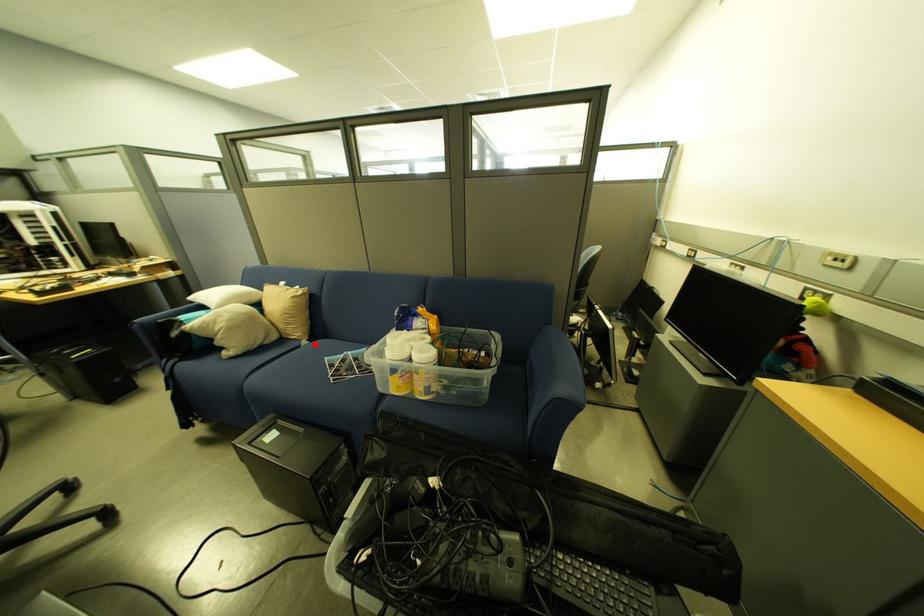
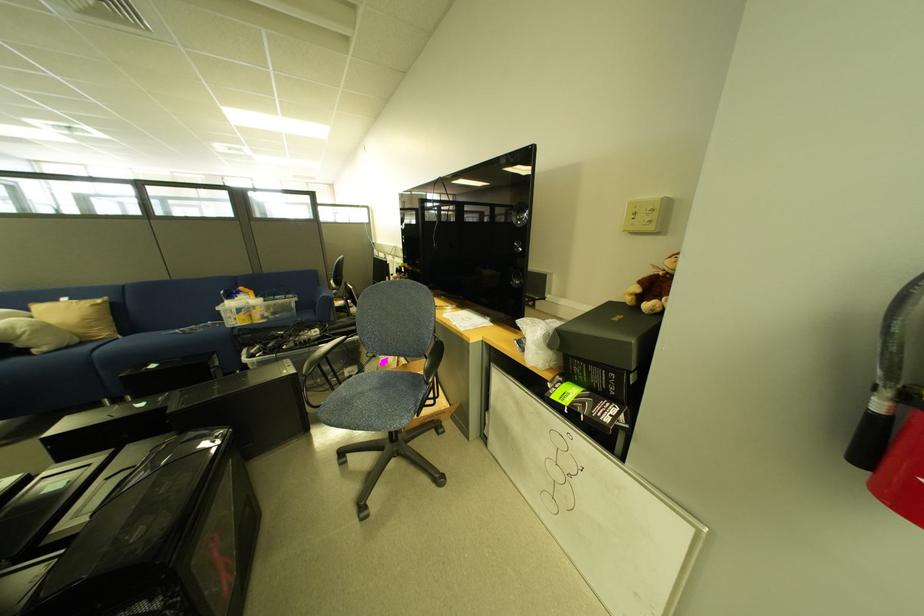
Question: I am providing you with two images of the same scene from different viewpoints. A red point is shown in image1. For the corresponding object point in image2, is it positioned nearer or farther from the camera?

Choices:
 (A) Nearer
 (B) Farther

Answer: (B)